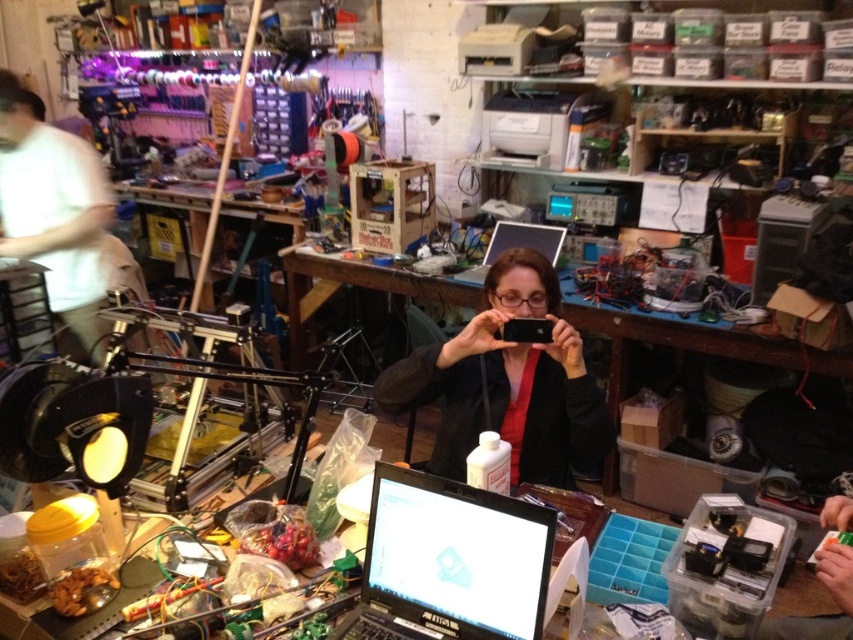
Question: Which of the following is the farthest from the observer?

Choices:
 (A) (509, 243)
 (B) (473, 339)
 (C) (738, 340)
 (D) (540, 588)

Answer: (A)

Question: Does black matte jacket at center appear over wooden table at center?

Choices:
 (A) no
 (B) yes

Answer: (A)

Question: Estimate the real-world distances between objects in this image. Which object is farther from the wooden table at center?

Choices:
 (A) black matte jacket at center
 (B) black glossy laptop at center
 (C) silver metallic laptop at center

Answer: (B)

Question: Does wooden table at center have a greater width compared to silver metallic laptop at center?

Choices:
 (A) yes
 (B) no

Answer: (A)

Question: Estimate the real-world distances between objects in this image. Which object is farther from the wooden table at center?

Choices:
 (A) black glossy laptop at center
 (B) black matte jacket at center

Answer: (A)

Question: Can you confirm if wooden table at center is positioned below silver metallic laptop at center?

Choices:
 (A) yes
 (B) no

Answer: (A)